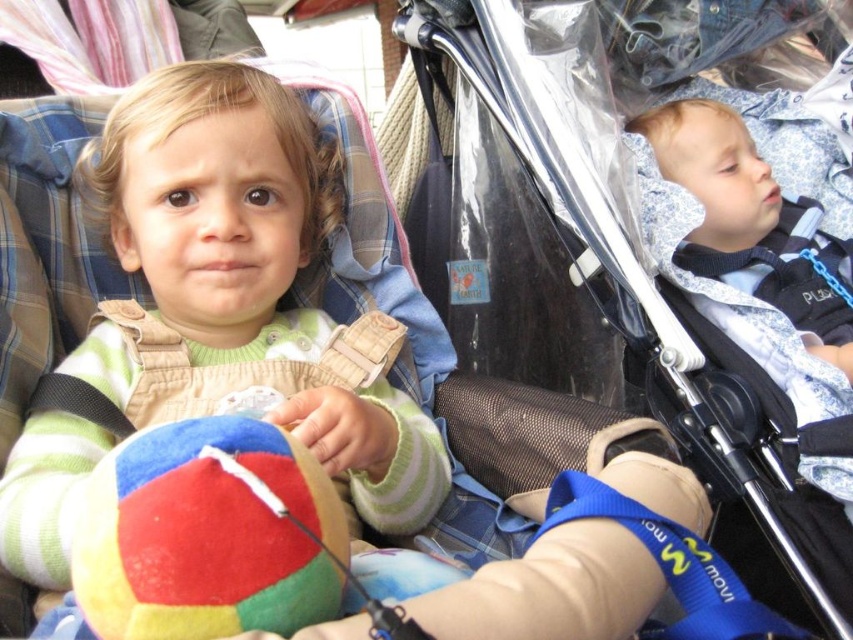
You are a parent holding the transparent plastic baby carriage at upper right and want to give the multicolored felt ball at center to your child. Can you easily hand the ball to them without moving the carriage?

The transparent plastic baby carriage at upper right is further to the viewer than the multicolored felt ball at center, so the ball is closer to the child. Therefore, you can easily hand the multicolored felt ball at center to your child without moving the carriage.

You are a parent trying to locate your child in a crowded park. You remember your child was wearing a soft fleece sweater at center and sitting in a transparent plastic baby carriage at upper right. Based on the scene description, can you determine which object is positioned to the right of the other?

The transparent plastic baby carriage at upper right is positioned to the right of the soft fleece sweater at center.